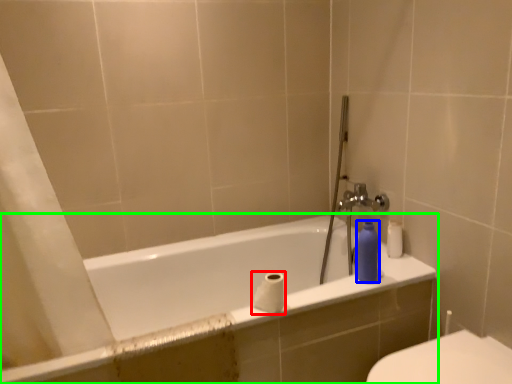
Question: Which object is positioned closest to toilet paper (highlighted by a red box)? Select from toiletry (highlighted by a blue box) and bathtub (highlighted by a green box).

Choices:
 (A) toiletry
 (B) bathtub

Answer: (A)